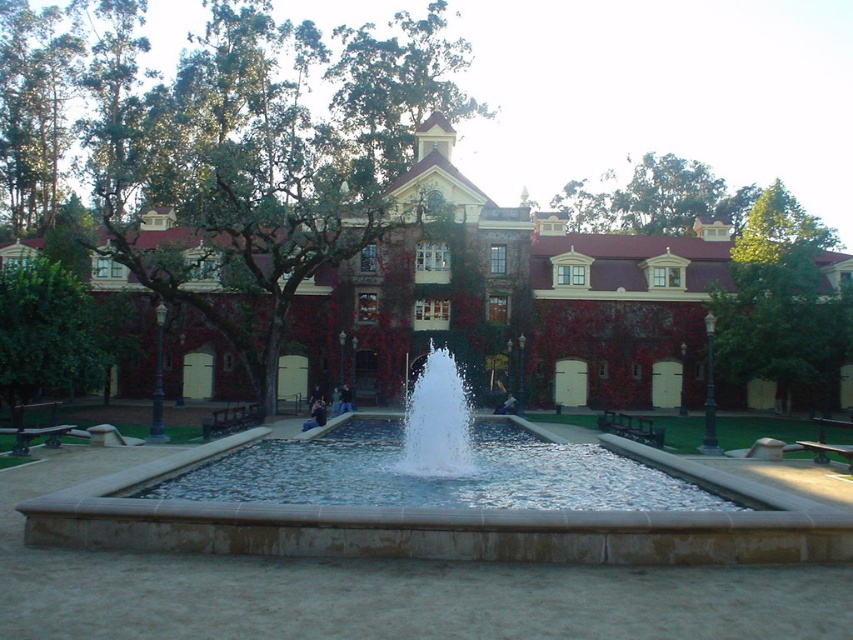
Question: Among these points, which one is farthest from the camera?

Choices:
 (A) (457, 451)
 (B) (142, 100)
 (C) (631, 179)

Answer: (C)

Question: Does green leafy tree at center have a lesser width compared to white water at center?

Choices:
 (A) no
 (B) yes

Answer: (A)

Question: Which object appears closest to the camera in this image?

Choices:
 (A) green leafy tree at center
 (B) green leafy tree at upper right

Answer: (A)

Question: Considering the real-world distances, which object is farthest from the green leafy tree at upper right?

Choices:
 (A) green leafy tree at upper center
 (B) green leafy tree at center
 (C) white water at center

Answer: (B)

Question: Does green leafy tree at upper right appear on the right side of green leafy tree at upper center?

Choices:
 (A) no
 (B) yes

Answer: (B)

Question: Does green leafy tree at center have a lesser width compared to green leafy tree at upper center?

Choices:
 (A) yes
 (B) no

Answer: (B)